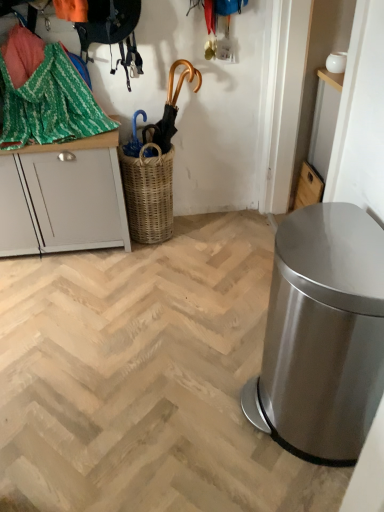
Identify the location of vacant space underneath green woven fabric at upper left (from a real-world perspective). This screenshot has width=384, height=512. (71, 134).